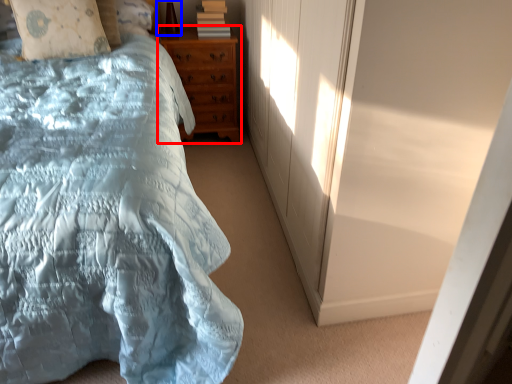
Question: Which object appears closest to the camera in this image, chest of drawers (highlighted by a red box) or table lamp (highlighted by a blue box)?

Choices:
 (A) chest of drawers
 (B) table lamp

Answer: (B)